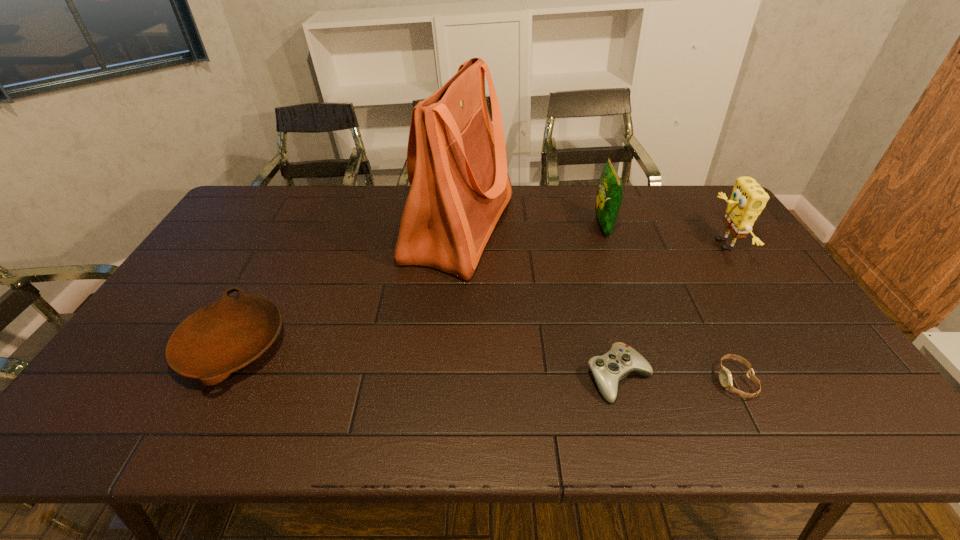
Where is `vacant space located on the face of the sponge`? vacant space located on the face of the sponge is located at coordinates (636, 245).

What are the coordinates of `free space located 0.180m on the face of the sponge` in the screenshot? It's located at (654, 245).

Where is `vacant space located 0.070m on the front-facing side of the crisp (potato chip)`? Image resolution: width=960 pixels, height=540 pixels. vacant space located 0.070m on the front-facing side of the crisp (potato chip) is located at coordinates (573, 226).

This screenshot has width=960, height=540. Find the location of `vacant space located 0.280m on the front-facing side of the crisp (potato chip)`. vacant space located 0.280m on the front-facing side of the crisp (potato chip) is located at coordinates (513, 226).

At what (x,y) coordinates should I click in order to perform the action: click on vacant space situated on the front-facing side of the crisp (potato chip). Please return your answer as a coordinate pair (x, y). The height and width of the screenshot is (540, 960). Looking at the image, I should click on (541, 226).

Locate an element on the screen. free region located on the right of the plate is located at coordinates (310, 347).

I want to click on free space located 0.320m on the left of the control, so click(x=452, y=378).

This screenshot has height=540, width=960. I want to click on vacant space positioned 0.240m on the face of the watch, so click(617, 381).

Where is `vacant area situated on the face of the watch`? vacant area situated on the face of the watch is located at coordinates (550, 381).

Find the location of a particular element. vacant space located on the face of the watch is located at coordinates (566, 381).